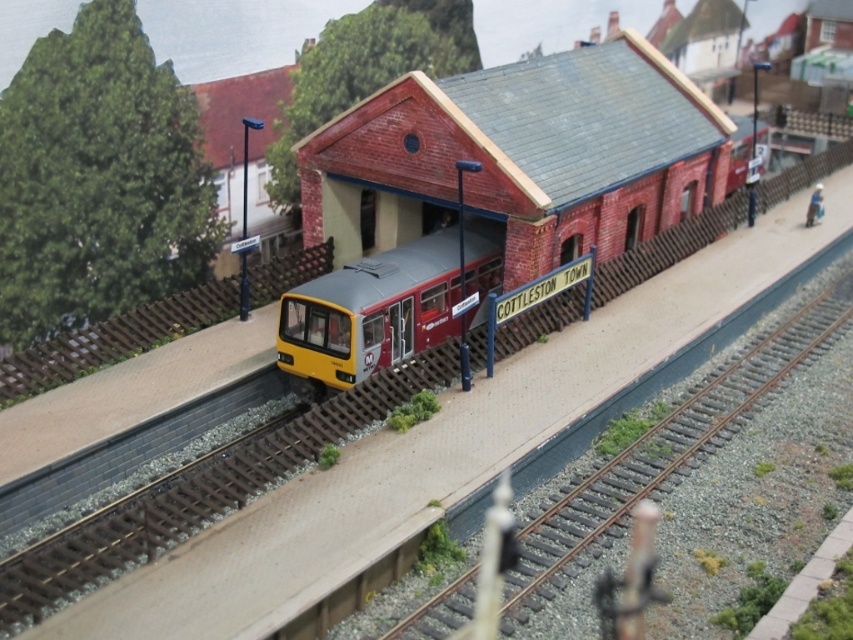
Question: Does metallic brown train track at center have a smaller size compared to yellow matte passenger train at center?

Choices:
 (A) yes
 (B) no

Answer: (B)

Question: Among these objects, which one is nearest to the camera?

Choices:
 (A) yellow matte passenger train at center
 (B) metallic brown train track at center

Answer: (B)

Question: Does metallic brown train track at center appear over yellow matte passenger train at center?

Choices:
 (A) yes
 (B) no

Answer: (B)

Question: Is metallic brown train track at center wider than yellow matte passenger train at center?

Choices:
 (A) yes
 (B) no

Answer: (A)